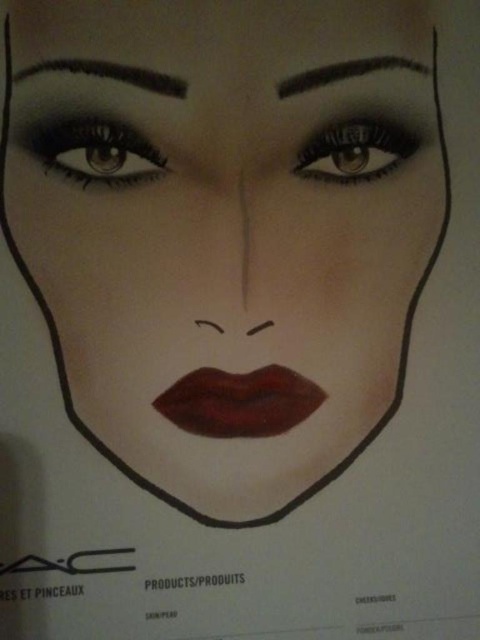
Describe the element at coordinates (240, 401) in the screenshot. This screenshot has height=640, width=480. I see `matte brown lipstick at center` at that location.

Between matte brown lipstick at center and shiny black eye at upper center, which one is positioned higher?

shiny black eye at upper center

Is point (227, 372) closer to camera compared to point (374, 170)?

That is True.

The image size is (480, 640). What are the coordinates of `matte brown lipstick at center` in the screenshot? It's located at (240, 401).

From the picture: Does matte brown eye at upper left appear under dark brown matte eyebrow at upper center?

Indeed, matte brown eye at upper left is positioned under dark brown matte eyebrow at upper center.

Image resolution: width=480 pixels, height=640 pixels. I want to click on matte brown eye at upper left, so click(95, 150).

This screenshot has height=640, width=480. Describe the element at coordinates (110, 74) in the screenshot. I see `dark brown matte eyebrow at upper left` at that location.

Does dark brown matte eyebrow at upper left have a lesser width compared to dark brown matte eyebrow at upper center?

Incorrect, dark brown matte eyebrow at upper left's width is not less than dark brown matte eyebrow at upper center's.

This screenshot has width=480, height=640. What do you see at coordinates (110, 74) in the screenshot? I see `dark brown matte eyebrow at upper left` at bounding box center [110, 74].

I want to click on dark brown matte eyebrow at upper left, so (x=110, y=74).